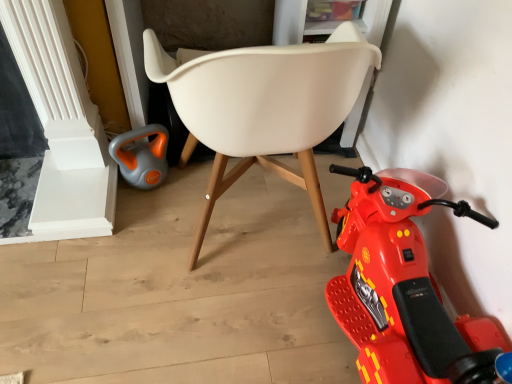
Locate an element on the screen. free space that is in between gray-orange plastic kettle at lower left and shiny plastic scooter at lower right is located at coordinates (245, 249).